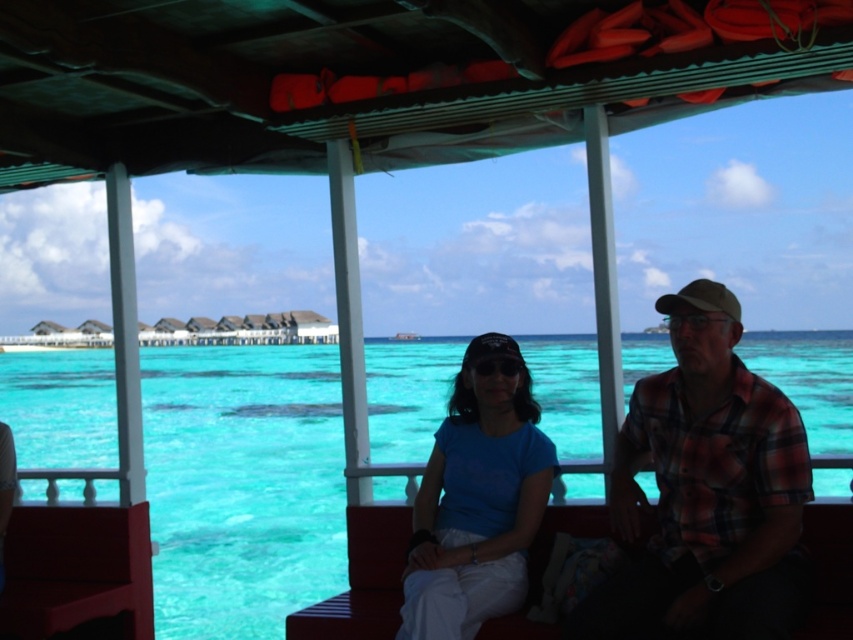
Question: Which point appears farthest from the camera in this image?

Choices:
 (A) (444, 460)
 (B) (47, 410)
 (C) (723, 522)

Answer: (B)

Question: Which point is farther to the camera?

Choices:
 (A) click(804, 586)
 (B) click(305, 525)
 (C) click(454, 486)

Answer: (B)

Question: Which point appears closest to the camera in this image?

Choices:
 (A) [x=242, y=468]
 (B) [x=714, y=625]

Answer: (B)

Question: Does turquoise clear water at center appear on the right side of blue matte shirt at center?

Choices:
 (A) no
 (B) yes

Answer: (A)

Question: Is turquoise clear water at center further to the viewer compared to blue matte shirt at center?

Choices:
 (A) no
 (B) yes

Answer: (B)

Question: Can you confirm if plaid fabric shirt at right is thinner than blue matte shirt at center?

Choices:
 (A) no
 (B) yes

Answer: (A)